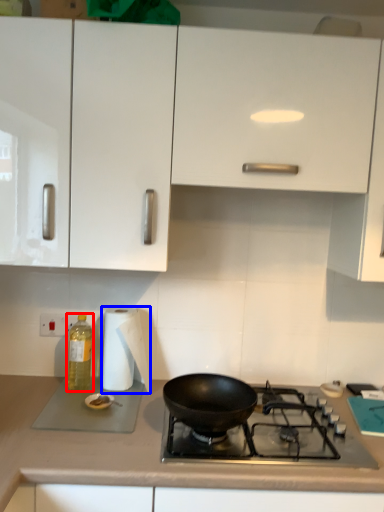
Question: Which object appears closest to the camera in this image, bottle (highlighted by a red box) or paper towel (highlighted by a blue box)?

Choices:
 (A) bottle
 (B) paper towel

Answer: (B)